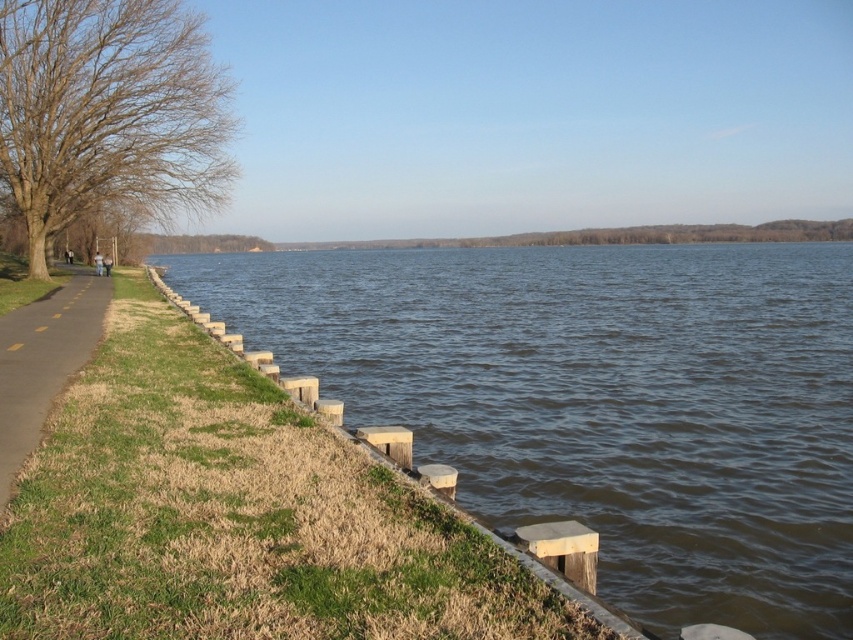
Question: Can you confirm if brown leafless tree at left is positioned to the right of yellow painted asphalt at left?

Choices:
 (A) yes
 (B) no

Answer: (B)

Question: Is green grass at lower left above brown leafless tree at left?

Choices:
 (A) no
 (B) yes

Answer: (A)

Question: Which point is farther to the camera?

Choices:
 (A) green grass at lower left
 (B) brown leafless tree at left

Answer: (B)

Question: Among these objects, which one is farthest from the camera?

Choices:
 (A) yellow painted asphalt at left
 (B) brown leafless tree at left

Answer: (B)

Question: Does green grass at lower left have a larger size compared to brown leafless tree at left?

Choices:
 (A) no
 (B) yes

Answer: (A)

Question: Which point is closer to the camera?

Choices:
 (A) (9, 376)
 (B) (20, 502)

Answer: (B)